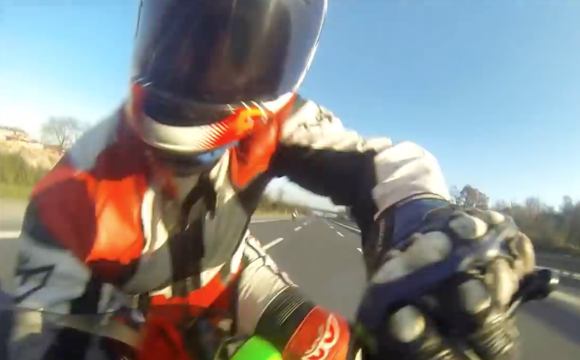
Find the location of `handle`. handle is located at coordinates coord(539,281).